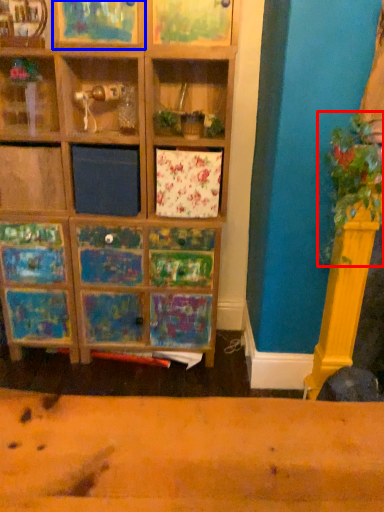
Question: Which point is further to the camera, plant (highlighted by a red box) or shelf (highlighted by a blue box)?

Choices:
 (A) plant
 (B) shelf

Answer: (B)